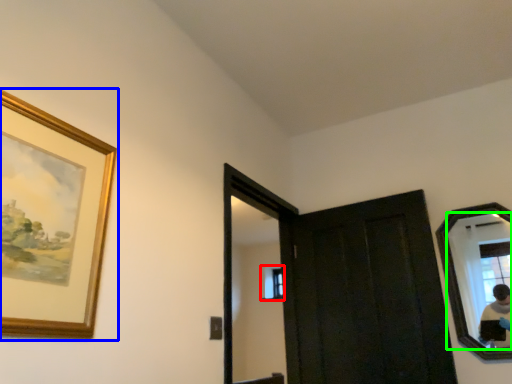
Question: Estimate the real-world distances between objects in this image. Which object is farther from window (highlighted by a red box), picture frame (highlighted by a blue box) or mirror (highlighted by a green box)?

Choices:
 (A) picture frame
 (B) mirror

Answer: (A)